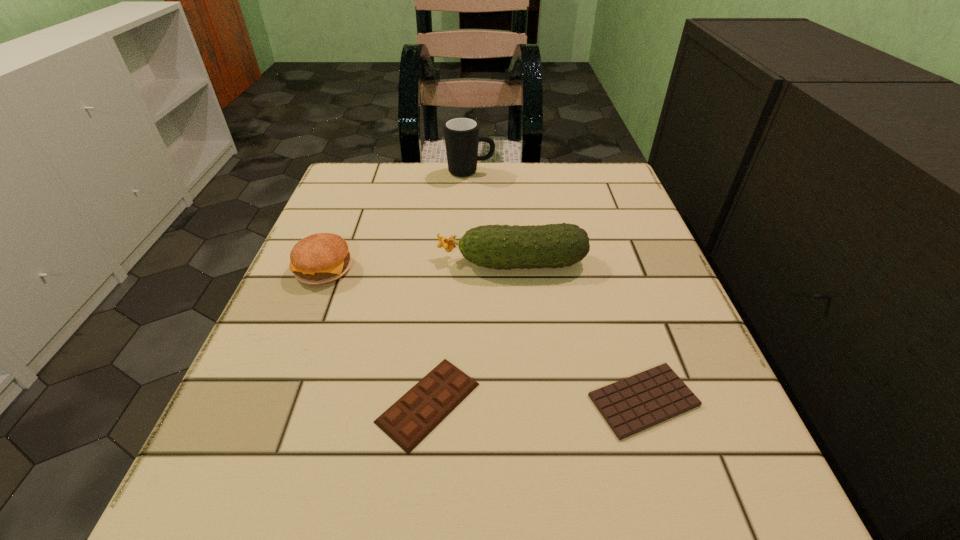
At what (x,y) coordinates should I click in order to perform the action: click on free space at the far edge of the desktop. Please return your answer as a coordinate pair (x, y). The height and width of the screenshot is (540, 960). Looking at the image, I should click on (421, 215).

What are the coordinates of `vacant space at the near edge of the desktop` in the screenshot? It's located at (545, 480).

Find the location of `vacant space at the left edge`. vacant space at the left edge is located at coordinates (369, 271).

Locate an element on the screen. free space at the right edge of the desktop is located at coordinates (675, 314).

Image resolution: width=960 pixels, height=540 pixels. In order to click on vacant space at the far left corner in this screenshot , I will do `click(362, 185)`.

Locate an element on the screen. free spot at the near left corner of the desktop is located at coordinates (256, 490).

Identify the location of vacant space at the far right corner. (579, 178).

Find the location of a particular element. free space between the fourth shortest object and the tallest object is located at coordinates (492, 217).

You are a GUI agent. You are given a task and a screenshot of the screen. Output one action in this format:
    pyautogui.click(x=<x>, y=<y>)
    Task: Click on the free space between the shorter chocolate bar and the leftmost object
    The image size is (960, 540).
    Given the screenshot: What is the action you would take?
    pyautogui.click(x=484, y=334)

Image resolution: width=960 pixels, height=540 pixels. Find the location of `vacant region between the fourth shortest object and the left chocolate bar`. vacant region between the fourth shortest object and the left chocolate bar is located at coordinates (470, 332).